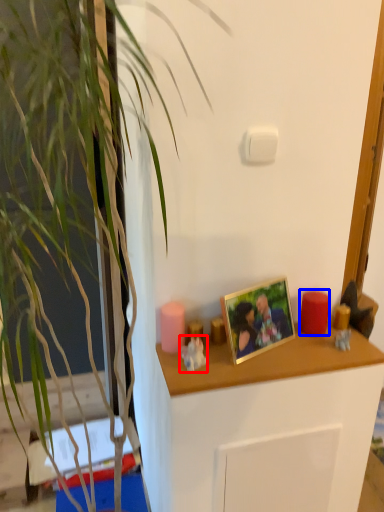
Question: Which object is closer to the camera taking this photo, toy (highlighted by a red box) or candle (highlighted by a blue box)?

Choices:
 (A) toy
 (B) candle

Answer: (A)